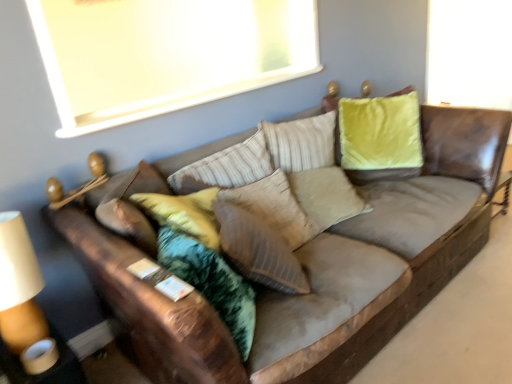
Question: Is suede textured pillow at center at the back of white matte window screen at upper center?

Choices:
 (A) yes
 (B) no

Answer: (B)

Question: Is white matte window screen at upper center to the left of suede textured pillow at center from the viewer's perspective?

Choices:
 (A) yes
 (B) no

Answer: (A)

Question: Is white matte window screen at upper center outside of suede textured pillow at center?

Choices:
 (A) no
 (B) yes

Answer: (B)

Question: Considering the relative positions of white matte window screen at upper center and suede textured pillow at center in the image provided, is white matte window screen at upper center in front of suede textured pillow at center?

Choices:
 (A) no
 (B) yes

Answer: (A)

Question: Is the position of white matte window screen at upper center more distant than that of suede textured pillow at center?

Choices:
 (A) yes
 (B) no

Answer: (A)

Question: Considering the relative positions of white matte window screen at upper center and suede textured pillow at center in the image provided, is white matte window screen at upper center to the right of suede textured pillow at center from the viewer's perspective?

Choices:
 (A) yes
 (B) no

Answer: (B)

Question: From a real-world perspective, is white matte window screen at upper center physically below brown leather couch at center?

Choices:
 (A) yes
 (B) no

Answer: (B)

Question: Can you confirm if white matte window screen at upper center is smaller than brown leather couch at center?

Choices:
 (A) yes
 (B) no

Answer: (A)

Question: From a real-world perspective, is white matte window screen at upper center positioned over brown leather couch at center based on gravity?

Choices:
 (A) yes
 (B) no

Answer: (A)

Question: From the image's perspective, is white matte window screen at upper center on brown leather couch at center?

Choices:
 (A) yes
 (B) no

Answer: (A)

Question: Can you confirm if white matte window screen at upper center is wider than brown leather couch at center?

Choices:
 (A) no
 (B) yes

Answer: (A)

Question: Is white matte window screen at upper center in contact with brown leather couch at center?

Choices:
 (A) no
 (B) yes

Answer: (A)

Question: Does suede textured pillow at center turn towards white matte window screen at upper center?

Choices:
 (A) no
 (B) yes

Answer: (A)